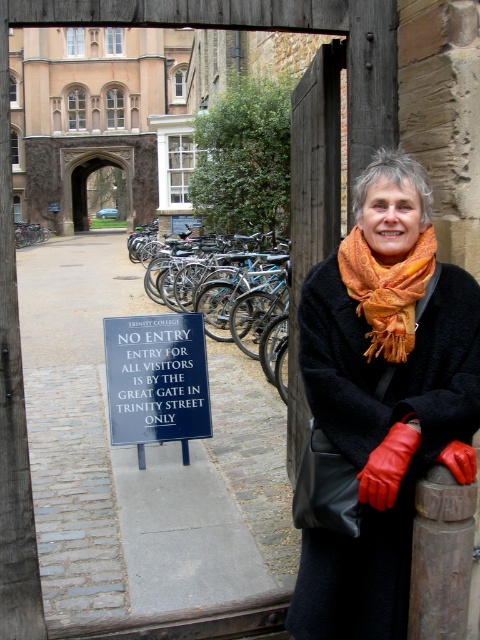
Question: Can you confirm if orange scarf at upper center is positioned to the left of blue metallic bicycle at center?

Choices:
 (A) yes
 (B) no

Answer: (B)

Question: Which of these objects is positioned farthest from the brown wooden post at center?

Choices:
 (A) blue plastic sign at center
 (B) orange woven scarf at upper center
 (C) blue metallic bicycle at center

Answer: (C)

Question: Which object is closer to the camera taking this photo?

Choices:
 (A) blue metallic bicycle at center
 (B) orange woven scarf at upper center

Answer: (B)

Question: Is blue metallic bicycle at center positioned in front of orange woven scarf at upper center?

Choices:
 (A) yes
 (B) no

Answer: (B)

Question: Among these points, which one is nearest to the camera?

Choices:
 (A) (425, 477)
 (B) (230, 292)
 (C) (141, 360)
 (D) (396, 269)

Answer: (A)

Question: Can you confirm if blue plastic sign at center is positioned above blue metallic bicycle at center?

Choices:
 (A) yes
 (B) no

Answer: (A)